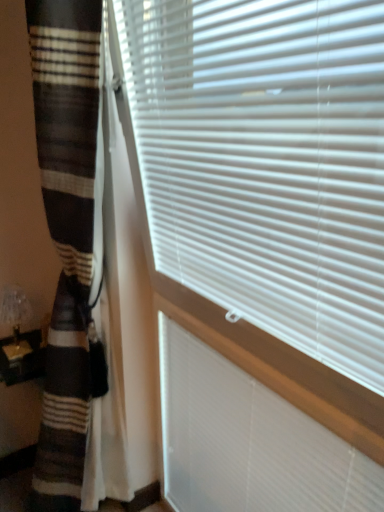
Question: From the image's perspective, is white plastic blinds at center above or below translucent glass table lamp at lower left?

Choices:
 (A) above
 (B) below

Answer: (B)

Question: In terms of height, does white plastic blinds at center look taller or shorter compared to translucent glass table lamp at lower left?

Choices:
 (A) short
 (B) tall

Answer: (B)

Question: Estimate the real-world distances between objects in this image. Which object is closer to the striped wool blanket at left?

Choices:
 (A) brown striped curtain at left
 (B) white plastic blinds at upper right
 (C) white plastic blinds at center
 (D) translucent glass table lamp at lower left

Answer: (A)

Question: Which is farther from the translucent glass table lamp at lower left?

Choices:
 (A) white plastic blinds at center
 (B) white plastic blinds at upper right
 (C) brown striped curtain at left
 (D) striped wool blanket at left

Answer: (B)